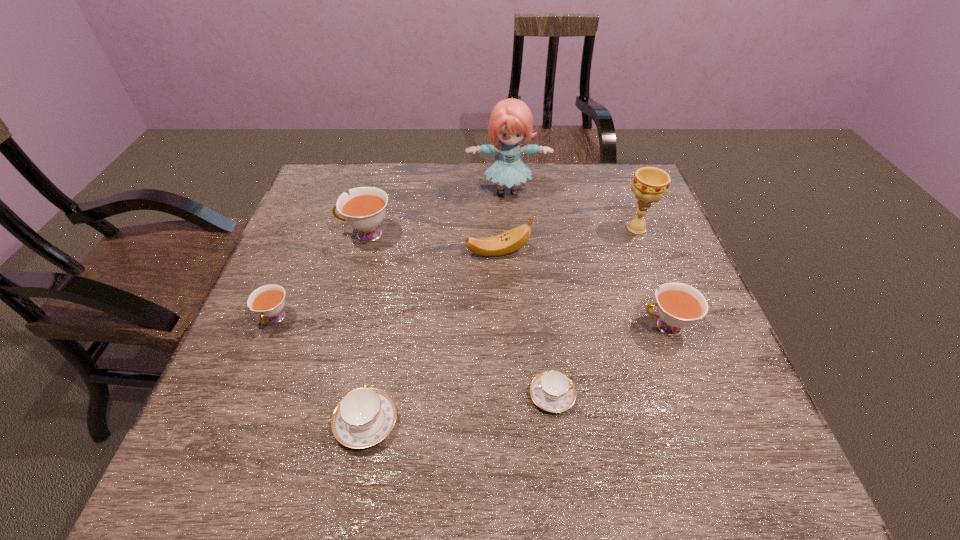
Where is `free space between the leftmost object and the doll`? This screenshot has height=540, width=960. free space between the leftmost object and the doll is located at coordinates (392, 255).

Identify the location of vacant space that is in between the left blue teacup and the farthest white teacup. This screenshot has height=540, width=960. (367, 328).

This screenshot has height=540, width=960. What are the coordinates of `free area in between the right blue teacup and the seventh shortest object` in the screenshot? It's located at (594, 312).

The height and width of the screenshot is (540, 960). Find the location of `empty space between the rightmost teacup and the second tallest object`. empty space between the rightmost teacup and the second tallest object is located at coordinates click(651, 278).

I want to click on free spot between the banana and the second teacup from right to left, so click(525, 323).

Locate which object ranks fourth in proximity to the leftmost white teacup. Please provide its 2D coordinates. Your answer should be formatted as a tuple, i.e. [(x, y)], where the tuple contains the x and y coordinates of a point satisfying the conditions above.

[(552, 391)]

Image resolution: width=960 pixels, height=540 pixels. Find the location of `object that stands as the closest to the leftmost object`. object that stands as the closest to the leftmost object is located at coordinates (364, 209).

Point out which teacup is positioned as the second nearest to the shortest teacup. Please provide its 2D coordinates. Your answer should be formatted as a tuple, i.e. [(x, y)], where the tuple contains the x and y coordinates of a point satisfying the conditions above.

[(365, 416)]

What are the coordinates of `teacup object that ranks as the second closest to the second tallest object` in the screenshot? It's located at (552, 391).

Identify which white teacup is the third nearest to the chalice. Please provide its 2D coordinates. Your answer should be formatted as a tuple, i.e. [(x, y)], where the tuple contains the x and y coordinates of a point satisfying the conditions above.

[(268, 301)]